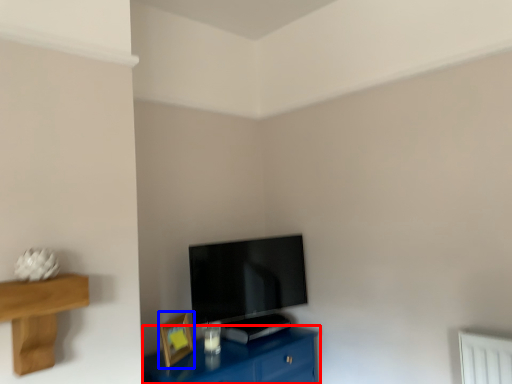
Question: Which of the following is the closest to the observer, table (highlighted by a red box) or picture frame (highlighted by a blue box)?

Choices:
 (A) table
 (B) picture frame

Answer: (A)